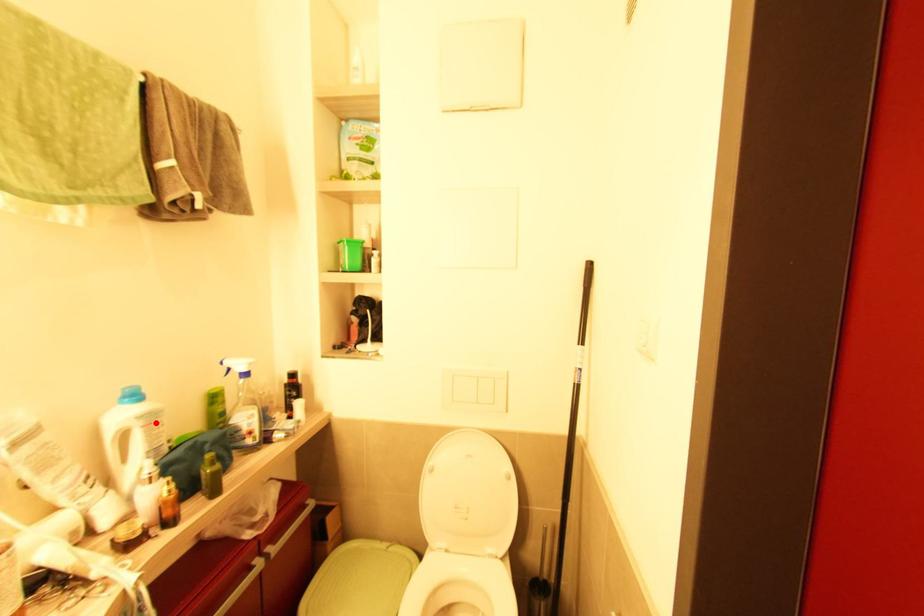
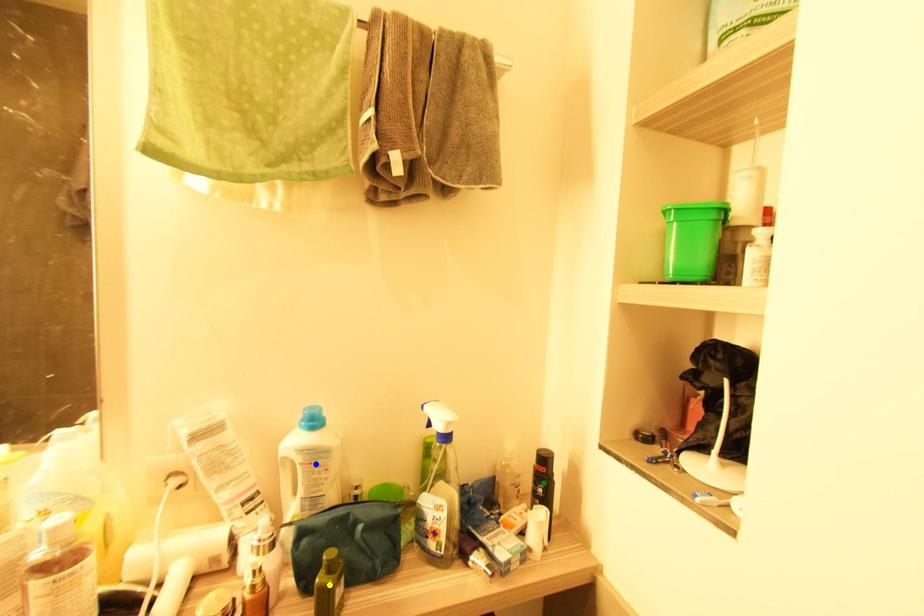
Question: I am providing you with two images of the same scene from different viewpoints. A red point is marked on the first image. You are given multiple points on the second image. In image 2, which mark is for the same physical point as the one in image 1?

Choices:
 (A) green point
 (B) yellow point
 (C) blue point

Answer: (C)